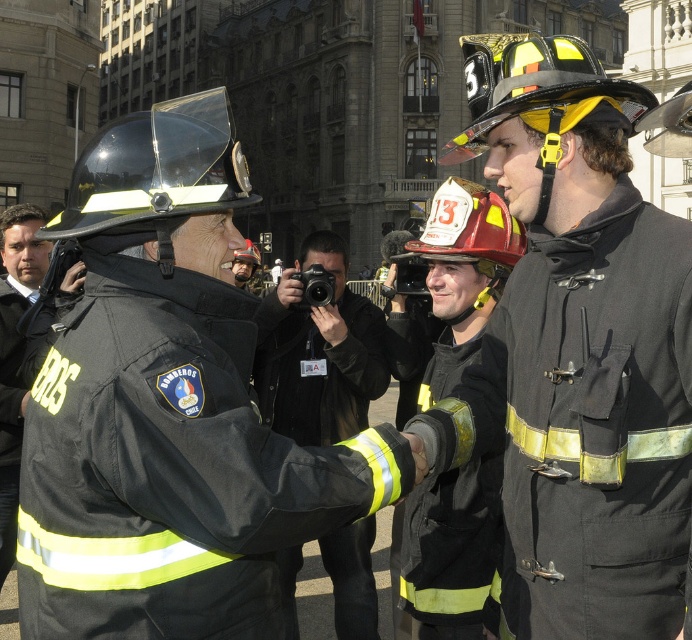
You are a photographer trying to capture the firefighters in the image. You want to focus on the black fabric uniform at center. Based on its position, where should you aim your camera?

The black fabric uniform at center is located at point [172,468], so you should aim your camera at those coordinates to focus on it.

You are a firefighter in the scene. You need to determine which item you are wearing that has a smaller thickness between the matte black helmet at center and the black fabric uniform at center. Which one is it?

The matte black helmet at center is thinner than the black fabric uniform at center, so the item with the smaller thickness is the matte black helmet at center.

You are a photographer trying to capture a photo of the black fabric uniform at center and the black fabric camera at center. Which object should you focus on first if you want to prioritize the closer one?

The black fabric uniform at center has a lesser height compared to the black fabric camera at center, so the black fabric uniform at center is closer to you. You should focus on the black fabric uniform at center first.